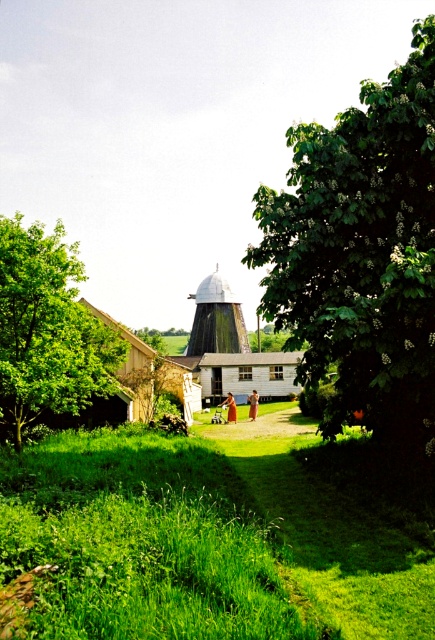
Based on the coordinates provided, where is the green leafy tree at center right located in the image?

The green leafy tree at center right is located at the 2D coordinates point of (364,262).